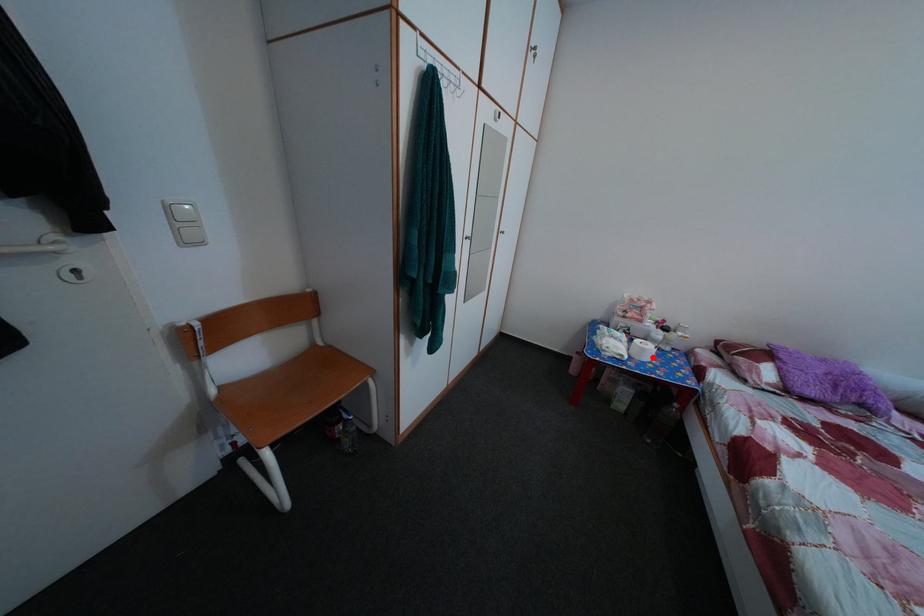
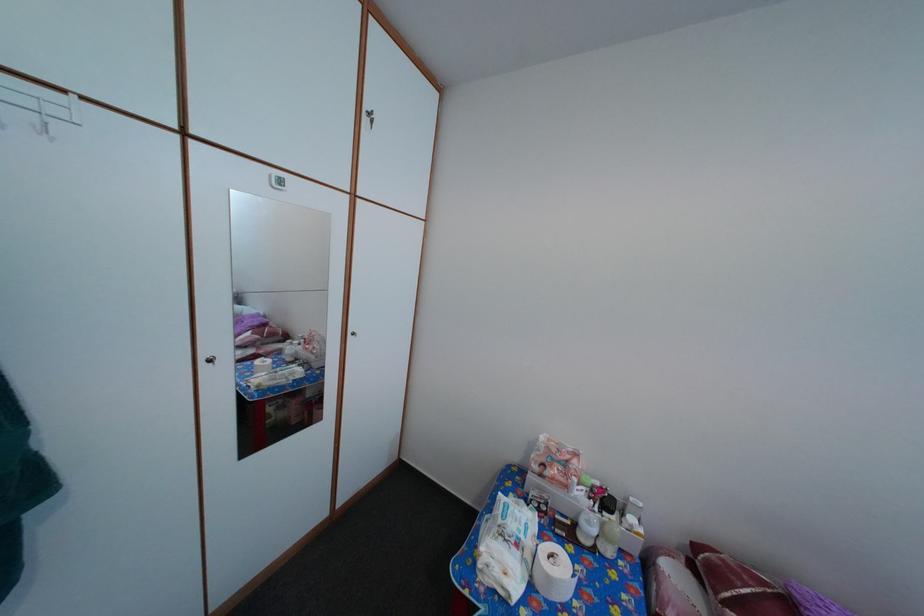
Find the pixel in the second image that matches the highlighted location in the first image.

(558, 586)